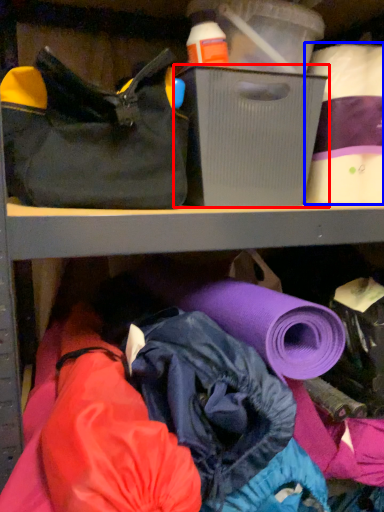
Question: Which point is closer to the camera, storage box (highlighted by a red box) or toilet paper (highlighted by a blue box)?

Choices:
 (A) storage box
 (B) toilet paper

Answer: (A)